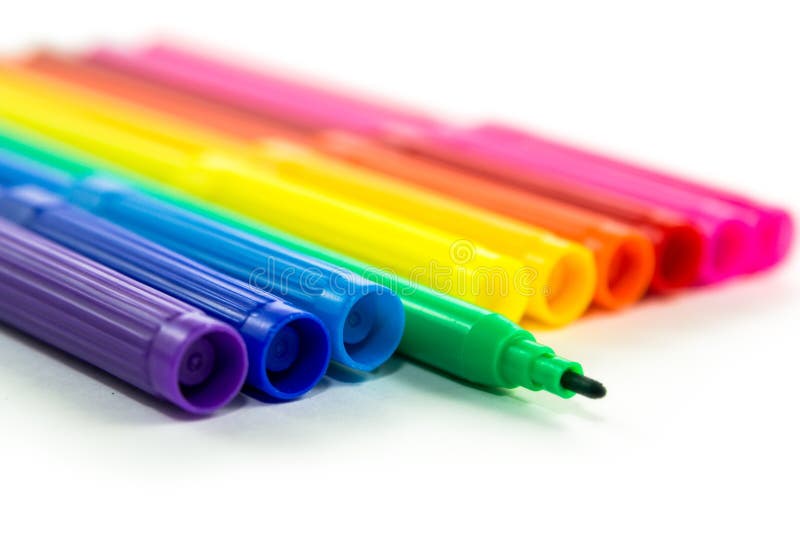
The image size is (800, 534). Identify the location of marker. (130, 315), (224, 299), (292, 292), (442, 318), (472, 268), (522, 247), (596, 239), (650, 212), (710, 209), (756, 214).